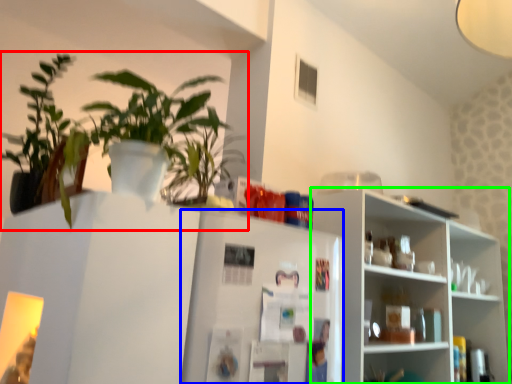
Question: Which object is positioned farthest from houseplant (highlighted by a red box)? Select from fridge (highlighted by a blue box) and shelf (highlighted by a green box).

Choices:
 (A) fridge
 (B) shelf

Answer: (B)